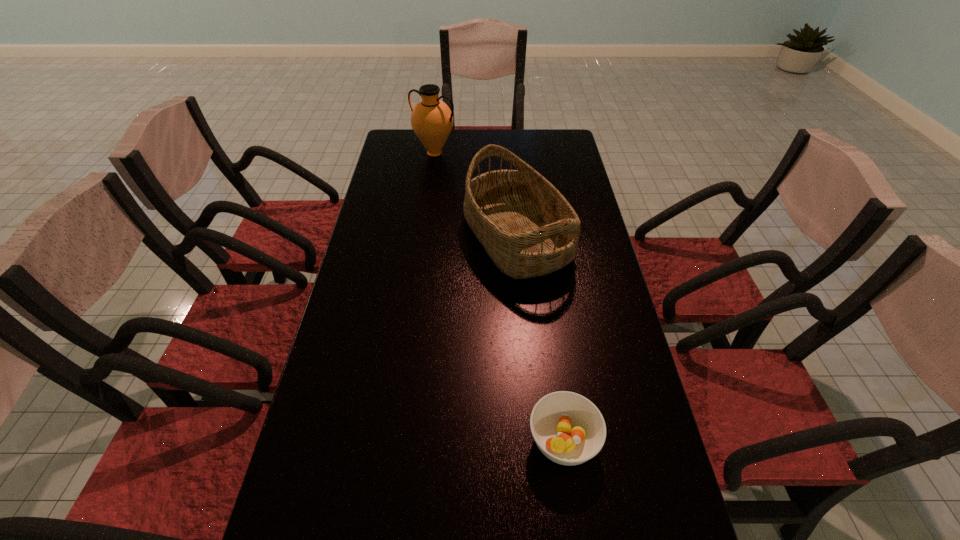
Image resolution: width=960 pixels, height=540 pixels. Identify the location of object identified as the closest to the leftmost object. (527, 227).

Identify which object is the second closest to the leftmost object. Please provide its 2D coordinates. Your answer should be formatted as a tuple, i.e. [(x, y)], where the tuple contains the x and y coordinates of a point satisfying the conditions above.

[(569, 429)]